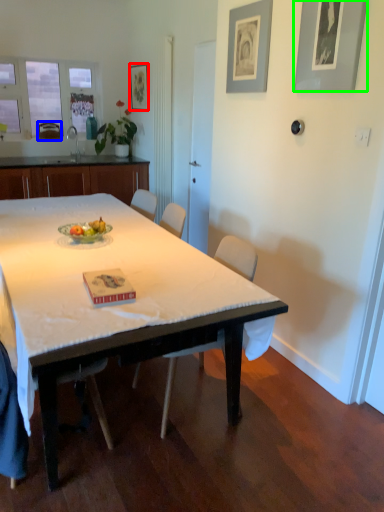
Question: Which object is positioned closest to picture frame (highlighted by a red box)? Select from chair (highlighted by a blue box) and picture frame (highlighted by a green box).

Choices:
 (A) chair
 (B) picture frame

Answer: (A)